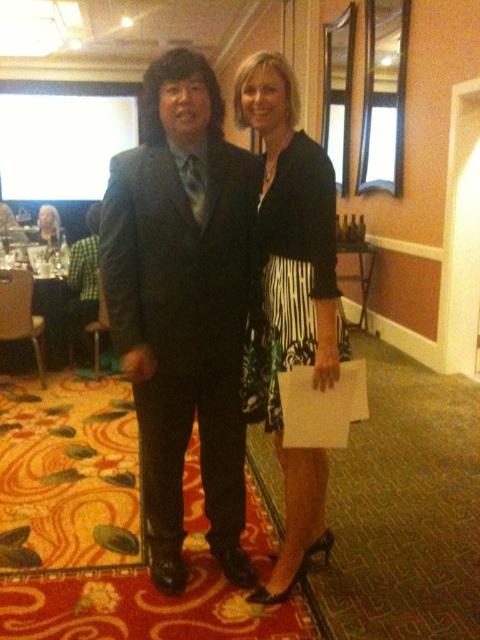
Question: Estimate the real-world distances between objects in this image. Which object is closer to the shiny black suit at center?

Choices:
 (A) matte black dress at center
 (B) black and white striped dress at center
 (C) black satin dress at center

Answer: (B)

Question: From the image, what is the correct spatial relationship of black satin dress at center in relation to matte black dress at center?

Choices:
 (A) below
 (B) above

Answer: (A)

Question: Based on their relative distances, which object is nearer to the black and white striped dress at center?

Choices:
 (A) black satin dress at center
 (B) shiny black suit at center

Answer: (A)

Question: Which object is the closest to the shiny black suit at center?

Choices:
 (A) black and white striped dress at center
 (B) black satin dress at center

Answer: (A)

Question: Is black satin dress at center to the left of matte black dress at center from the viewer's perspective?

Choices:
 (A) no
 (B) yes

Answer: (A)

Question: Can you confirm if black satin dress at center is positioned to the right of matte black dress at center?

Choices:
 (A) no
 (B) yes

Answer: (B)